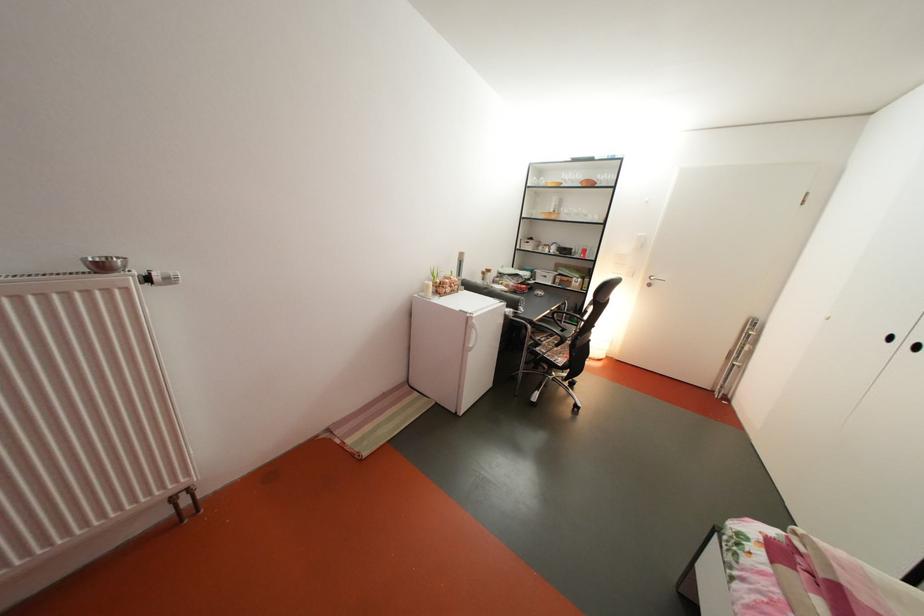
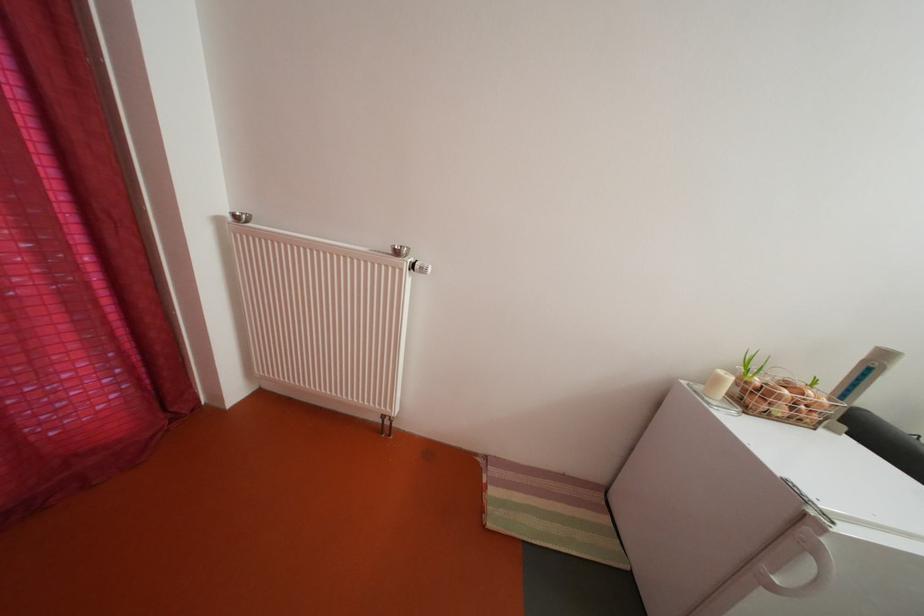
Where in the second image is the point corresponding to point 459,296 from the first image?

(792, 416)